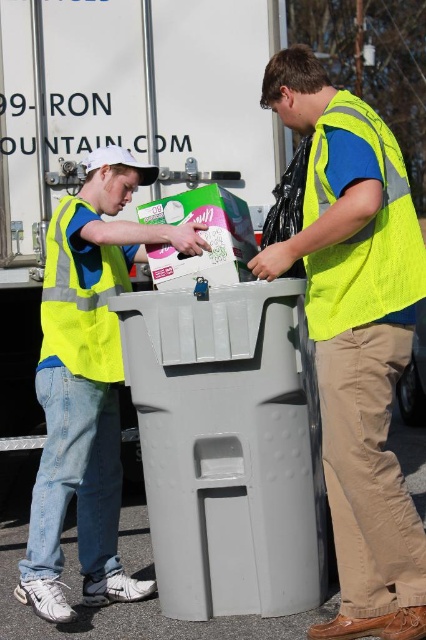
Which of these two, neon yellow vest at left or neon yellow mesh safety vest at right, stands shorter?

neon yellow mesh safety vest at right is shorter.

Where is `neon yellow vest at left`? This screenshot has height=640, width=426. neon yellow vest at left is located at coordinates (86, 381).

Image resolution: width=426 pixels, height=640 pixels. Describe the element at coordinates (86, 381) in the screenshot. I see `neon yellow vest at left` at that location.

In order to click on neon yellow vest at left in this screenshot , I will do `click(86, 381)`.

Is neon yellow vest at center thinner than neon yellow mesh safety vest at right?

No.

Measure the distance between neon yellow vest at center and neon yellow mesh safety vest at right.

They are 5.97 inches apart.

Find the location of a particular element. neon yellow vest at center is located at coordinates (356, 337).

Which is more to the right, gray plastic recycling bin at center or neon yellow mesh safety vest at right?

neon yellow mesh safety vest at right

This screenshot has height=640, width=426. In order to click on gray plastic recycling bin at center in this screenshot , I will do `click(229, 448)`.